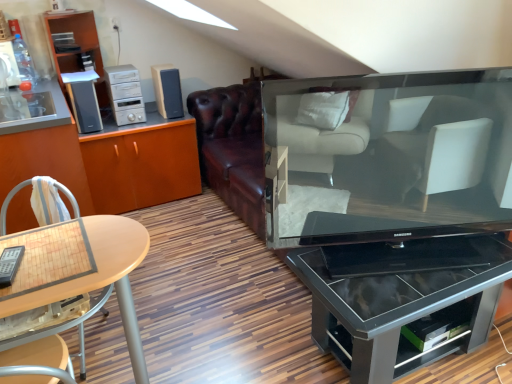
Question: Is satin black speaker at upper left, acting as the 1th appliance starting from the left, turned away from matte wood cabinet at left, positioned as the first cabinetry in right-to-left order?

Choices:
 (A) yes
 (B) no

Answer: (B)

Question: From the image's perspective, does satin black speaker at upper left, acting as the 1th appliance starting from the left, appear higher than matte wood cabinet at left, positioned as the first cabinetry in right-to-left order?

Choices:
 (A) no
 (B) yes

Answer: (B)

Question: Considering the relative sizes of satin black speaker at upper left, arranged as the second appliance when viewed from the right, and matte wood cabinet at left, positioned as the first cabinetry in right-to-left order, in the image provided, is satin black speaker at upper left, arranged as the second appliance when viewed from the right, bigger than matte wood cabinet at left, positioned as the first cabinetry in right-to-left order,?

Choices:
 (A) yes
 (B) no

Answer: (B)

Question: Considering the relative sizes of satin black speaker at upper left, arranged as the second appliance when viewed from the right, and matte wood cabinet at left, positioned as the first cabinetry in right-to-left order, in the image provided, is satin black speaker at upper left, arranged as the second appliance when viewed from the right, wider than matte wood cabinet at left, positioned as the first cabinetry in right-to-left order,?

Choices:
 (A) yes
 (B) no

Answer: (B)

Question: Are satin black speaker at upper left, acting as the 1th appliance starting from the left, and matte wood cabinet at left, positioned as the first cabinetry in right-to-left order, located far from each other?

Choices:
 (A) no
 (B) yes

Answer: (A)

Question: Considering the relative positions of satin black speaker at upper left, arranged as the second appliance when viewed from the right, and matte wood cabinet at left, the 2th cabinetry from the left, in the image provided, is satin black speaker at upper left, arranged as the second appliance when viewed from the right, to the left of matte wood cabinet at left, the 2th cabinetry from the left, from the viewer's perspective?

Choices:
 (A) no
 (B) yes

Answer: (B)

Question: Is wooden cabinet at left, the 1th cabinetry in the left-to-right sequence, thinner than matte wood shelf at upper left?

Choices:
 (A) no
 (B) yes

Answer: (A)

Question: Considering the relative sizes of wooden cabinet at left, the 1th cabinetry in the left-to-right sequence, and matte wood shelf at upper left in the image provided, is wooden cabinet at left, the 1th cabinetry in the left-to-right sequence, smaller than matte wood shelf at upper left?

Choices:
 (A) no
 (B) yes

Answer: (A)

Question: Is wooden cabinet at left, arranged as the second cabinetry when viewed from the right, facing away from matte wood shelf at upper left?

Choices:
 (A) yes
 (B) no

Answer: (A)

Question: Can you confirm if wooden cabinet at left, arranged as the second cabinetry when viewed from the right, is wider than matte wood shelf at upper left?

Choices:
 (A) yes
 (B) no

Answer: (A)

Question: Does wooden cabinet at left, the 1th cabinetry in the left-to-right sequence, appear on the right side of matte wood shelf at upper left?

Choices:
 (A) yes
 (B) no

Answer: (B)

Question: Is wooden cabinet at left, the 1th cabinetry in the left-to-right sequence, outside matte wood shelf at upper left?

Choices:
 (A) no
 (B) yes

Answer: (B)

Question: Is black glossy television at center in contact with matte wood shelf at upper left?

Choices:
 (A) no
 (B) yes

Answer: (A)